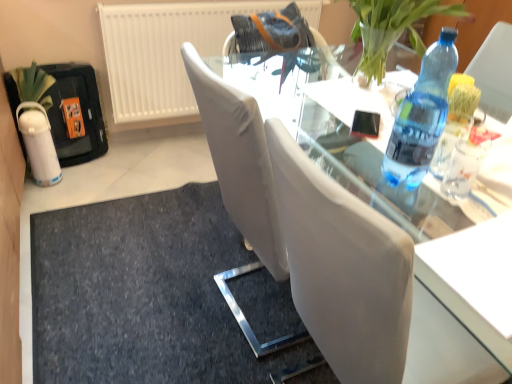
The height and width of the screenshot is (384, 512). What are the coordinates of `vacant space underneath dark gray fabric doormat at lower center (from a real-world perspective)` in the screenshot? It's located at pyautogui.click(x=137, y=269).